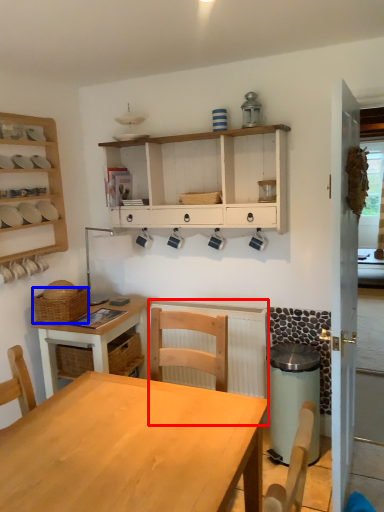
Question: Which of the following is the farthest to the observer, radiator (highlighted by a red box) or basket (highlighted by a blue box)?

Choices:
 (A) radiator
 (B) basket

Answer: (A)